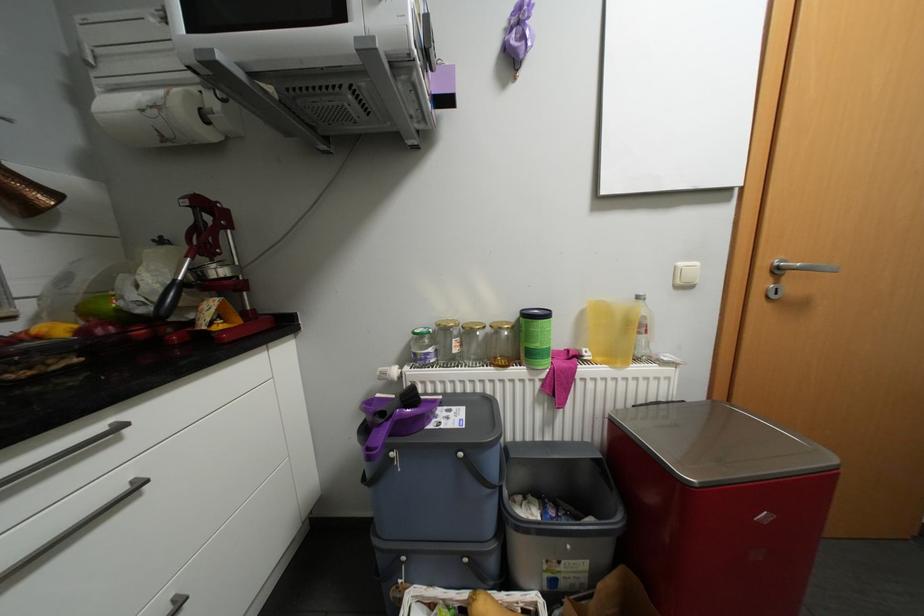
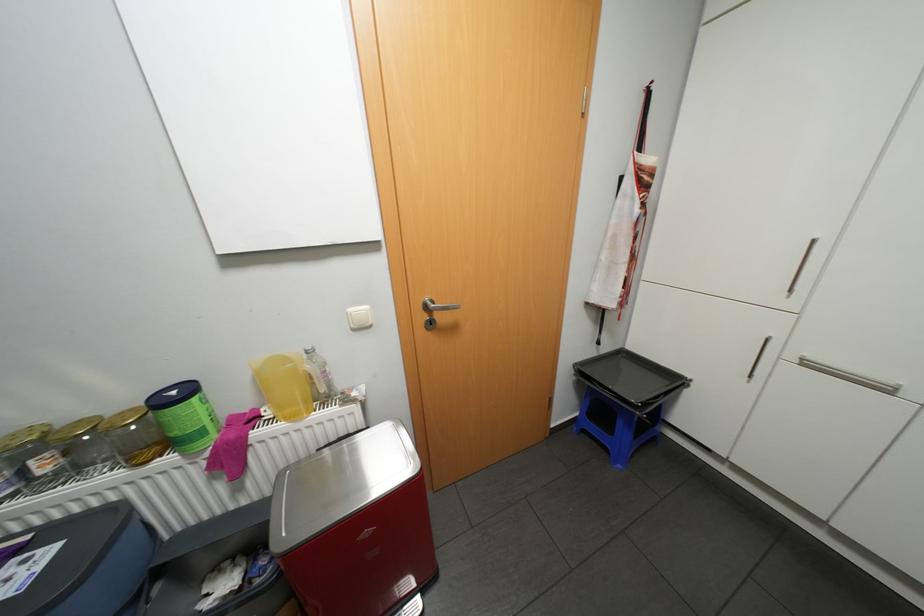
In the second image, find the point that corresponds to point 688,262 in the first image.

(358, 309)